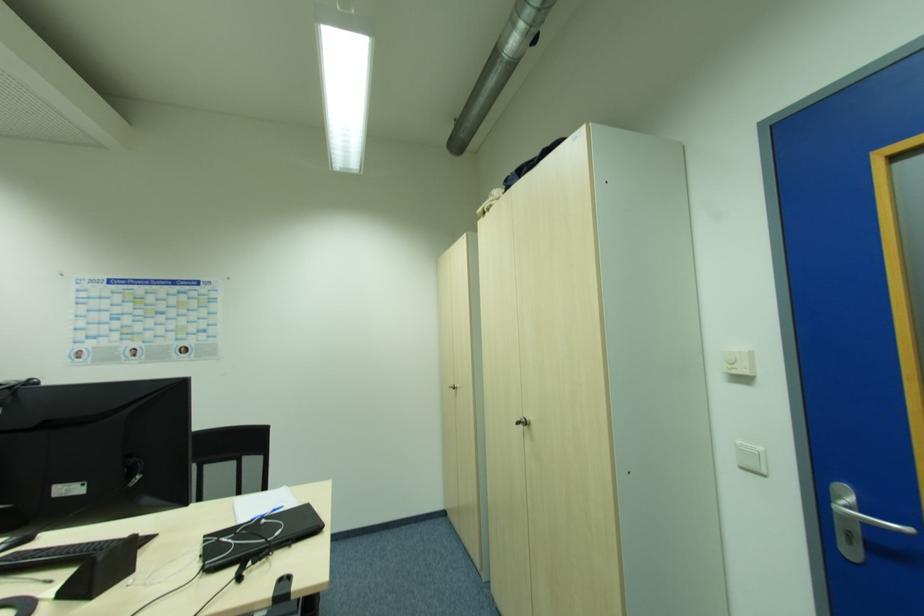
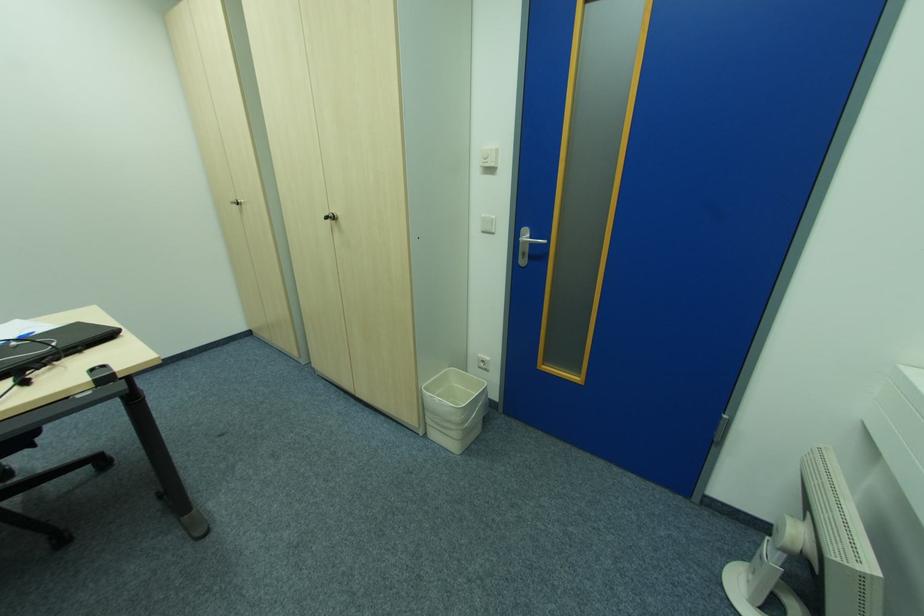
Where in the second image is the point corresponding to point 526,424 from the first image?

(334, 219)